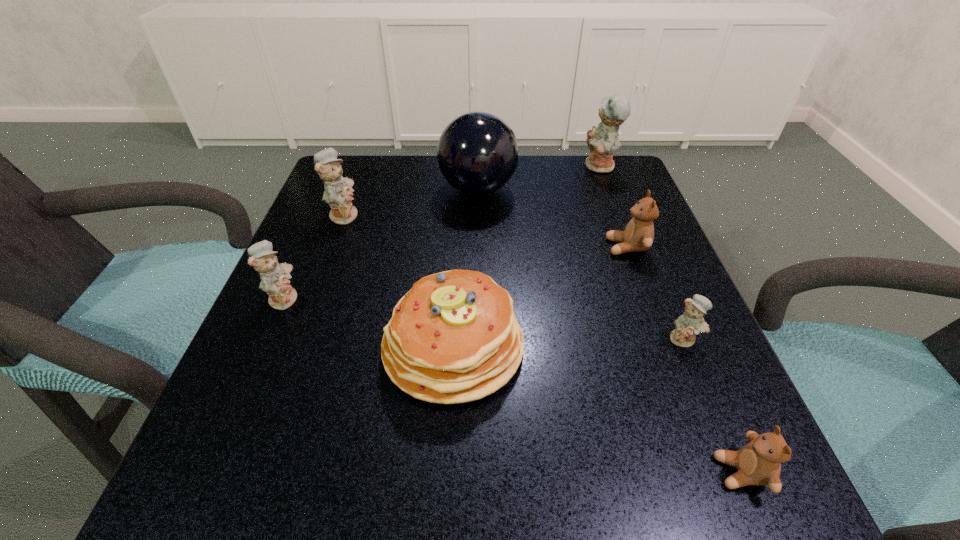
At what (x,y) coordinates should I click in order to perform the action: click on vacant space located 0.350m on the front-facing side of the third farthest teddy bear. Please return your answer as a coordinate pair (x, y). The image size is (960, 540). Looking at the image, I should click on (430, 247).

Where is `free region located 0.390m on the front-facing side of the third farthest teddy bear`? This screenshot has height=540, width=960. free region located 0.390m on the front-facing side of the third farthest teddy bear is located at coordinates (410, 247).

I want to click on blank space located 0.180m on the front-facing side of the fourth farthest teddy bear, so click(x=402, y=298).

I want to click on vacant space located on the right of the pancake, so click(x=707, y=346).

Find the location of `vacant space located 0.110m on the front-facing side of the nearest blue teddy bear`. vacant space located 0.110m on the front-facing side of the nearest blue teddy bear is located at coordinates (715, 413).

Locate an element on the screen. The height and width of the screenshot is (540, 960). vacant point located on the front-facing side of the smaller brown teddy bear is located at coordinates (542, 472).

In order to click on free space located on the front-facing side of the smaller brown teddy bear in this screenshot , I will do `click(590, 472)`.

Identify the location of vacant space situated 0.280m on the front-facing side of the smaller brown teddy bear. The image size is (960, 540). (495, 472).

Image resolution: width=960 pixels, height=540 pixels. I want to click on bowling ball at the far edge, so click(x=477, y=152).

Where is `object present at the near edge`? Image resolution: width=960 pixels, height=540 pixels. object present at the near edge is located at coordinates (759, 462).